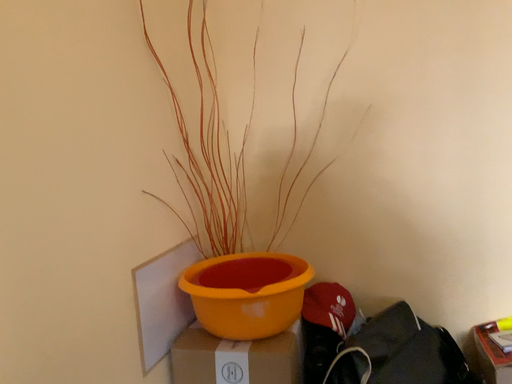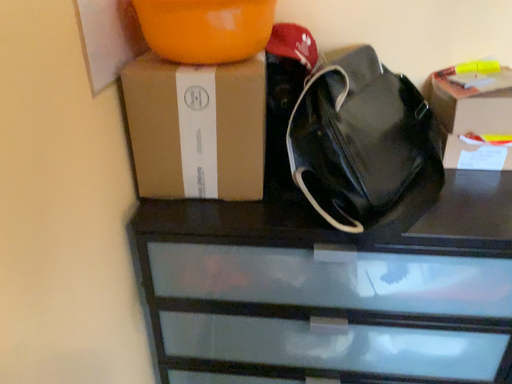
Question: How did the camera likely rotate when shooting the video?

Choices:
 (A) rotated right
 (B) rotated left

Answer: (A)